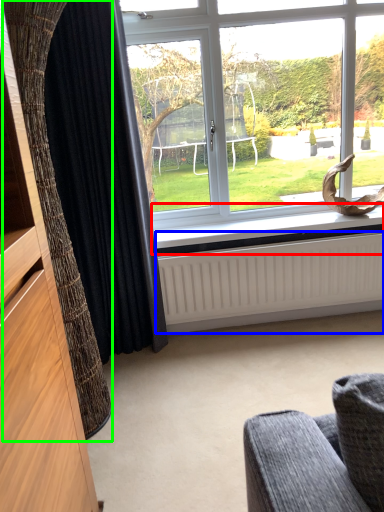
Question: Estimate the real-world distances between objects in this image. Which object is farther from window sill (highlighted by a red box), radiator (highlighted by a blue box) or curtain (highlighted by a green box)?

Choices:
 (A) radiator
 (B) curtain

Answer: (B)